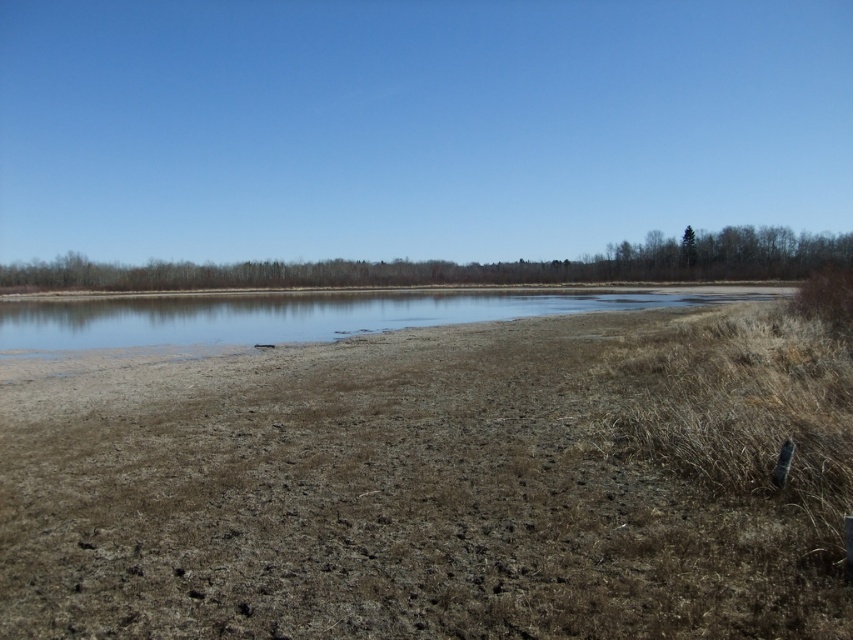
Question: Can you confirm if brown dry grass at center is positioned above clear water at center?

Choices:
 (A) no
 (B) yes

Answer: (A)

Question: Which point is closer to the camera?

Choices:
 (A) brown dry grass at center
 (B) clear water at center

Answer: (A)

Question: Which point is closer to the camera taking this photo?

Choices:
 (A) (253, 540)
 (B) (293, 316)

Answer: (A)

Question: Is brown dry grass at center further to camera compared to clear water at center?

Choices:
 (A) yes
 (B) no

Answer: (B)

Question: In this image, where is brown dry grass at center located relative to clear water at center?

Choices:
 (A) above
 (B) below

Answer: (B)